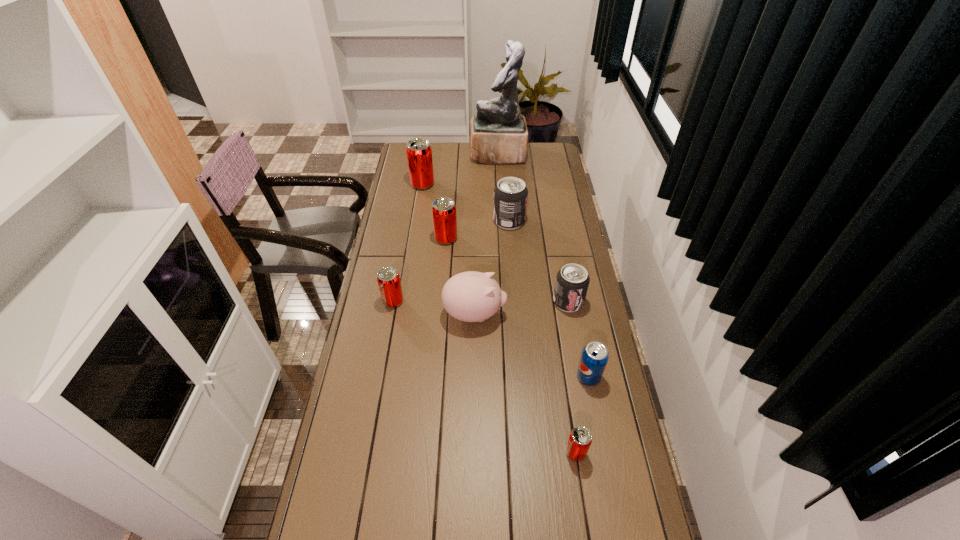
Where is `the tallest object`? The width and height of the screenshot is (960, 540). the tallest object is located at coordinates click(499, 135).

I want to click on the farthest object, so click(499, 135).

Locate an element on the screen. the eighth shortest object is located at coordinates (419, 152).

Identify the location of the eighth nearest object. This screenshot has width=960, height=540. (419, 152).

The image size is (960, 540). Find the location of `the third soda can from left to right`. the third soda can from left to right is located at coordinates (444, 215).

You are a GUI agent. You are given a task and a screenshot of the screen. Output one action in this format:
    pyautogui.click(x=<x>, y=<y>)
    Task: Click on the third nearest red soda can
    The width and height of the screenshot is (960, 540).
    Given the screenshot: What is the action you would take?
    pyautogui.click(x=444, y=215)

This screenshot has width=960, height=540. Find the location of `the fourth soda can from right to left`. the fourth soda can from right to left is located at coordinates (510, 194).

Identify the location of the left black soda can. (510, 194).

This screenshot has width=960, height=540. I want to click on piggy bank, so click(471, 296).

The image size is (960, 540). In order to click on the nearer black soda can in this screenshot , I will do `click(572, 281)`.